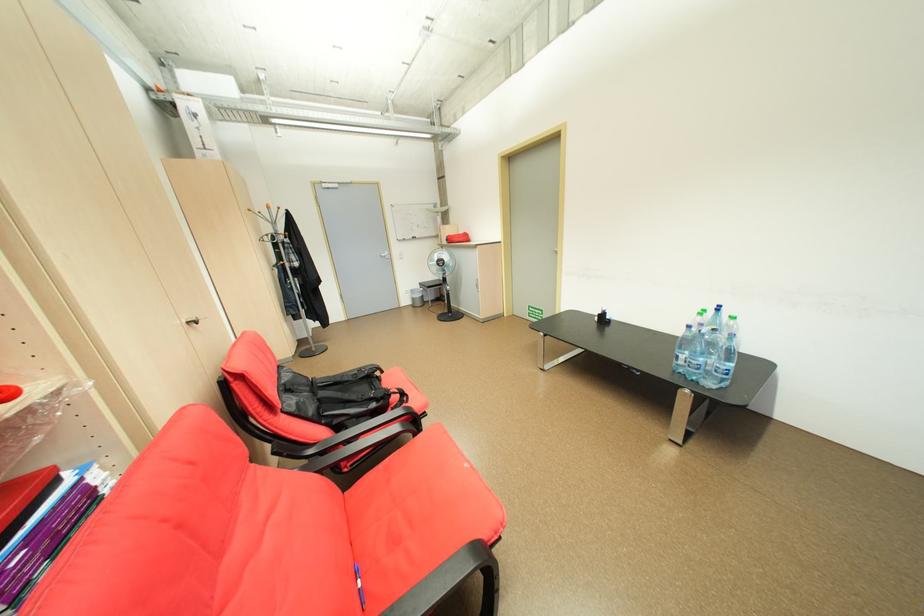
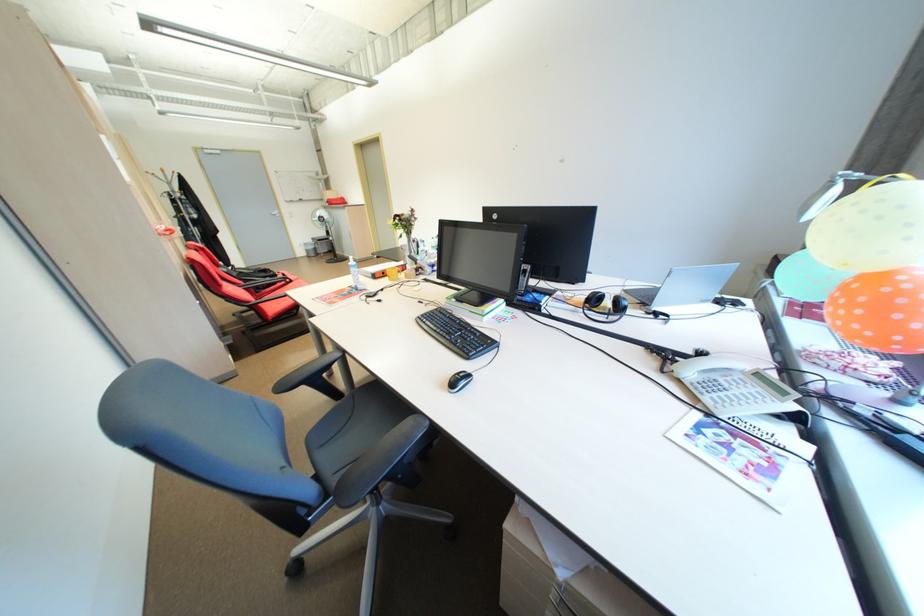
In the second image, find the point that corresponds to the point at 421,300 in the first image.

(315, 252)